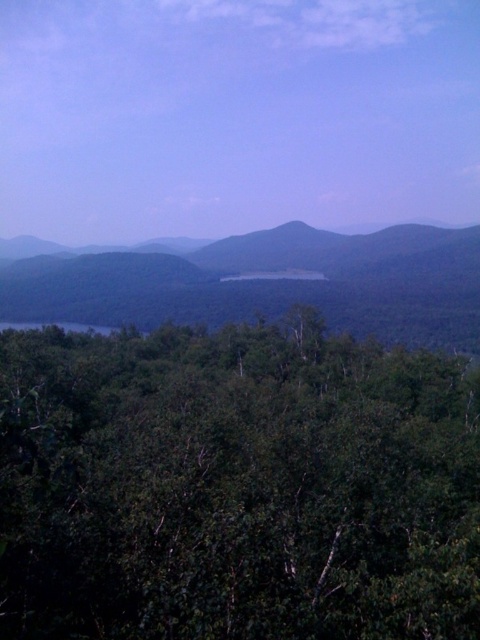
You are standing in the forest and see the green leafy tree at center and the green leafy forest at center. Which one is positioned more to the right?

The green leafy tree at center is positioned to the right of the green leafy forest at center.

You are standing in the forest and want to find the tallest tree. You see a green leafy tree at center and a green leafy forest at center. Which one is taller?

The green leafy forest at center is taller than the green leafy tree at center.

You are standing in the forest and see a point marked at coordinates [237,486]. What object is located at that point?

The point at coordinates [237,486] corresponds to the green leafy tree at center.